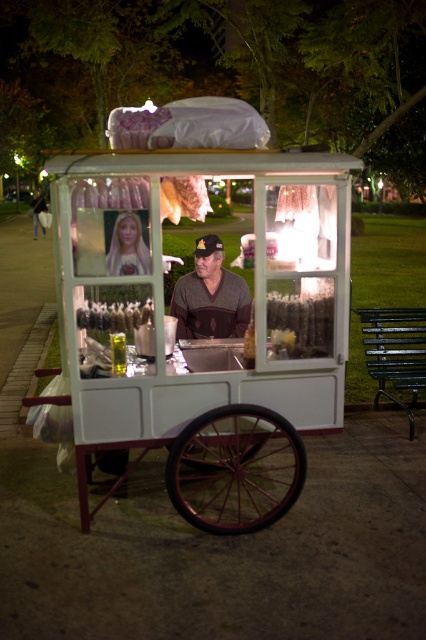
Question: Which object is farther from the camera taking this photo?

Choices:
 (A) dark brown sweater at center
 (B) white wood cart at center

Answer: (A)

Question: Does blonde hair at center have a greater width compared to white plastic popcorn at center?

Choices:
 (A) yes
 (B) no

Answer: (B)

Question: Which object is the farthest from the white plastic popcorn at center?

Choices:
 (A) white wood cart at center
 (B) dark brown sweater at center

Answer: (B)

Question: Does blonde hair at center have a larger size compared to white plastic popcorn at center?

Choices:
 (A) no
 (B) yes

Answer: (A)

Question: Which is nearer to the blonde hair at center?

Choices:
 (A) dark brown sweater at center
 (B) white plastic popcorn at center

Answer: (B)

Question: From the image, what is the correct spatial relationship of white wood cart at center in relation to white plastic popcorn at center?

Choices:
 (A) right
 (B) left

Answer: (A)